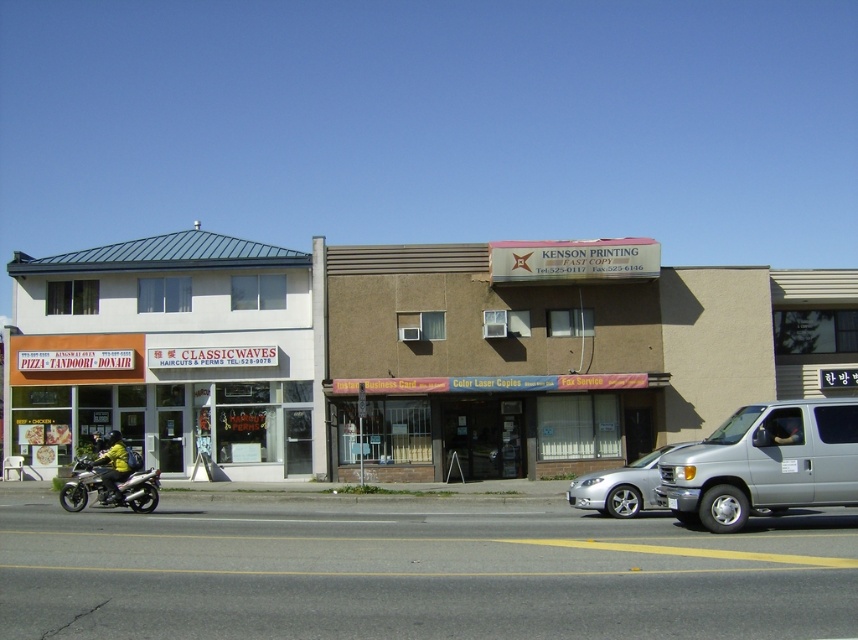
You are a delivery person standing in front of the restaurant and need to load a large package onto the metallic silver motorcycle at lower left. The package is 1.5 meters tall. Considering the height of the motorcycle and the yellow fabric jacket at lower left, can you safely place the package on top of the motorcycle without it touching the jacket?

The metallic silver motorcycle at lower left is taller than the yellow fabric jacket at lower left. Since the package is 1.5 meters tall, if the motorcycle is taller than the jacket, the package might still exceed the motorcycle height. However, the description only states the motorcycle is taller than the jacket, but doesn not provide exact measurements. Without knowing the exact height of the motorcycle, it is uncertain if the package will fit safely.

You are standing in front of the two buildings and want to place a new sign between the two points, point (590, 472) and point (97, 460). Which point should the sign be closer to so that it appears larger to someone looking at the buildings from the street?

The sign should be placed closer to point (97, 460) because it is closer to the camera, making it appear larger when viewed from the street.

You are a delivery person who needs to park your 24 inch wide delivery cart between the metallic silver motorcycle at lower left and the yellow fabric jacket at lower left. Is there enough space between them for your cart?

The metallic silver motorcycle at lower left and yellow fabric jacket at lower left are 20.39 inches apart from each other. Since the cart is 24 inches wide, there isn not enough space between them to fit the cart.